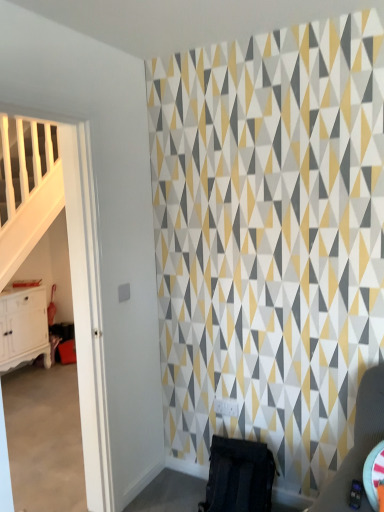
What do you see at coordinates (23, 327) in the screenshot?
I see `white glossy cabinet at left` at bounding box center [23, 327].

The height and width of the screenshot is (512, 384). What are the coordinates of `white glossy cabinet at left` in the screenshot? It's located at (23, 327).

The image size is (384, 512). Describe the element at coordinates (239, 476) in the screenshot. I see `black fabric swivel chair at lower center` at that location.

Find the location of a particular element. This screenshot has height=512, width=384. black fabric swivel chair at lower center is located at coordinates (239, 476).

This screenshot has width=384, height=512. I want to click on white glossy cabinet at left, so click(23, 327).

In the scene shown: Which is more to the right, white glossy cabinet at left or black fabric swivel chair at lower center?

Positioned to the right is black fabric swivel chair at lower center.

Considering the relative positions of white glossy cabinet at left and black fabric swivel chair at lower center in the image provided, is white glossy cabinet at left behind black fabric swivel chair at lower center?

Yes, white glossy cabinet at left is further from the viewer.

Is point (46, 314) closer to viewer compared to point (218, 464)?

No, it is behind (218, 464).

From the image's perspective, is white glossy cabinet at left beneath black fabric swivel chair at lower center?

No, from the image's perspective, white glossy cabinet at left is not below black fabric swivel chair at lower center.

From a real-world perspective, is white glossy cabinet at left physically located above or below black fabric swivel chair at lower center?

From a real-world perspective, white glossy cabinet at left is physically above black fabric swivel chair at lower center.

From the picture: Can you confirm if white glossy cabinet at left is thinner than black fabric swivel chair at lower center?

Correct, the width of white glossy cabinet at left is less than that of black fabric swivel chair at lower center.

In terms of height, does white glossy cabinet at left look taller or shorter compared to black fabric swivel chair at lower center?

In the image, white glossy cabinet at left appears to be taller than black fabric swivel chair at lower center.

Who is smaller, white glossy cabinet at left or black fabric swivel chair at lower center?

black fabric swivel chair at lower center.

Do you think white glossy cabinet at left is within black fabric swivel chair at lower center, or outside of it?

white glossy cabinet at left exists outside the volume of black fabric swivel chair at lower center.

In the scene shown: Are white glossy cabinet at left and black fabric swivel chair at lower center making contact?

There is a gap between white glossy cabinet at left and black fabric swivel chair at lower center.

Is white glossy cabinet at left aimed at black fabric swivel chair at lower center?

Yes, white glossy cabinet at left is aimed at black fabric swivel chair at lower center.

Where is `swivel chair on the right of the white glossy cabinet at left`? swivel chair on the right of the white glossy cabinet at left is located at coordinates (239, 476).

Can you confirm if black fabric swivel chair at lower center is positioned to the right of white glossy cabinet at left?

Indeed, black fabric swivel chair at lower center is positioned on the right side of white glossy cabinet at left.

Is the position of black fabric swivel chair at lower center less distant than that of white glossy cabinet at left?

Yes, it is in front of white glossy cabinet at left.

Which is in front, point (227, 499) or point (1, 325)?

Point (227, 499)

From the image's perspective, between black fabric swivel chair at lower center and white glossy cabinet at left, who is located below?

black fabric swivel chair at lower center appears lower in the image.

From a real-world perspective, is black fabric swivel chair at lower center located higher than white glossy cabinet at left?

No, from a real-world perspective, black fabric swivel chair at lower center is not over white glossy cabinet at left

Which object is wider, black fabric swivel chair at lower center or white glossy cabinet at left?

black fabric swivel chair at lower center.

From their relative heights in the image, would you say black fabric swivel chair at lower center is taller or shorter than white glossy cabinet at left?

Clearly, black fabric swivel chair at lower center is shorter compared to white glossy cabinet at left.

Does black fabric swivel chair at lower center have a smaller size compared to white glossy cabinet at left?

Yes.

Is black fabric swivel chair at lower center spatially inside white glossy cabinet at left, or outside of it?

black fabric swivel chair at lower center is spatially situated outside white glossy cabinet at left.

Would you say black fabric swivel chair at lower center is a long distance from white glossy cabinet at left?

That's right, there is a large distance between black fabric swivel chair at lower center and white glossy cabinet at left.

In the scene shown: Is black fabric swivel chair at lower center looking in the opposite direction of white glossy cabinet at left?

No, black fabric swivel chair at lower center is not facing the opposite direction of white glossy cabinet at left.

What's the angular difference between black fabric swivel chair at lower center and white glossy cabinet at left's facing directions?

The angular difference between black fabric swivel chair at lower center and white glossy cabinet at left is 88.2 degrees.

Where is `swivel chair lying below the white glossy cabinet at left (from the image's perspective)`? The image size is (384, 512). swivel chair lying below the white glossy cabinet at left (from the image's perspective) is located at coordinates [x=239, y=476].

Identify the location of swivel chair that is on the right side of white glossy cabinet at left. (239, 476).

This screenshot has width=384, height=512. What are the coordinates of `swivel chair in front of the white glossy cabinet at left` in the screenshot? It's located at (239, 476).